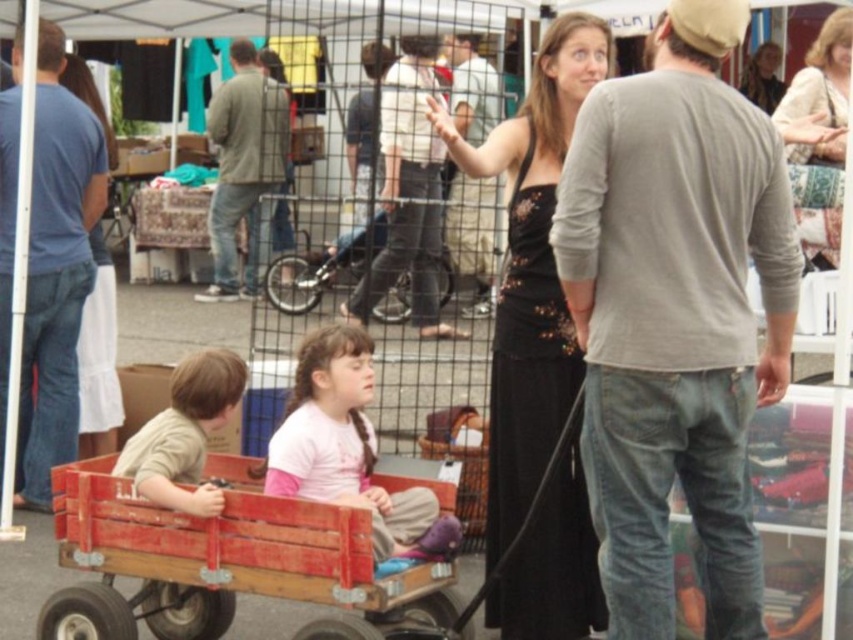
Consider the image. Is green cotton shirt at center below light beige textured sweater at upper right?

No.

Image resolution: width=853 pixels, height=640 pixels. What do you see at coordinates (242, 168) in the screenshot?
I see `green cotton shirt at center` at bounding box center [242, 168].

This screenshot has height=640, width=853. Find the location of `green cotton shirt at center`. green cotton shirt at center is located at coordinates (242, 168).

Find the location of a particular element. green cotton shirt at center is located at coordinates (242, 168).

Is blue denim jeans at left shorter than light brown smooth shirt at lower left?

No, blue denim jeans at left is not shorter than light brown smooth shirt at lower left.

The width and height of the screenshot is (853, 640). What do you see at coordinates (56, 269) in the screenshot? I see `blue denim jeans at left` at bounding box center [56, 269].

Image resolution: width=853 pixels, height=640 pixels. Find the location of `blue denim jeans at left`. blue denim jeans at left is located at coordinates (56, 269).

Looking at this image, does blue denim jeans at left lie in front of green cotton shirt at center?

Yes, blue denim jeans at left is in front of green cotton shirt at center.

Does blue denim jeans at left come behind green cotton shirt at center?

No, blue denim jeans at left is in front of green cotton shirt at center.

Does point (61, 225) lie in front of point (273, 164)?

Yes.

Where is `blue denim jeans at left`? Image resolution: width=853 pixels, height=640 pixels. blue denim jeans at left is located at coordinates (56, 269).